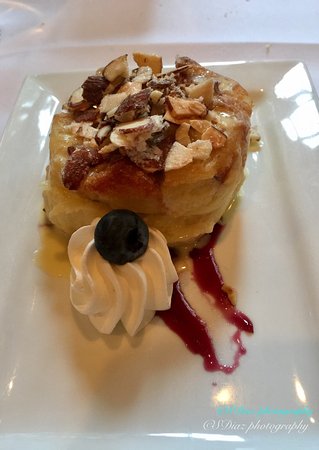
This screenshot has height=450, width=319. In order to click on white countertop in this screenshot , I will do `click(165, 17)`.